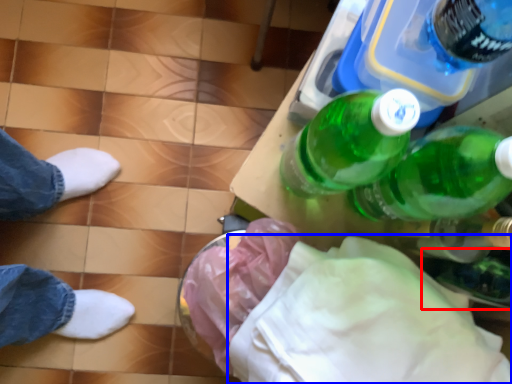
Question: Which of the following is the farthest to the observer, glass bottle (highlighted by a red box) or cloth (highlighted by a blue box)?

Choices:
 (A) glass bottle
 (B) cloth

Answer: (A)